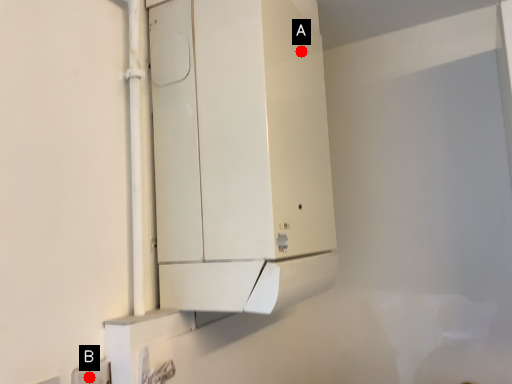
Question: Two points are circled on the image, labeled by A and B beside each circle. Which of the following is the farthest from the observer?

Choices:
 (A) A is further
 (B) B is further

Answer: (A)